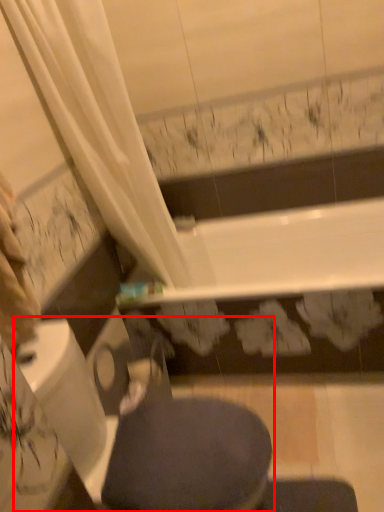
Question: From the image's perspective, considering the relative positions of swivel chair (annotated by the red box) and bidet in the image provided, where is swivel chair (annotated by the red box) located with respect to the staircase?

Choices:
 (A) above
 (B) below

Answer: (B)